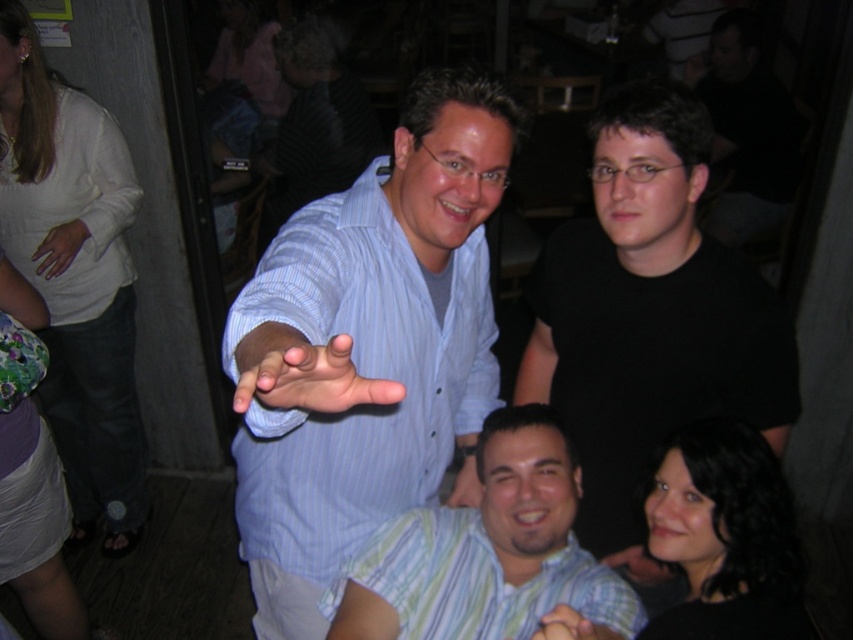
Between black matte shirt at upper right and matte blue shirt at center, which one is positioned higher?

matte blue shirt at center is above.

Between point (691, 193) and point (238, 403), which one is positioned in front?

Positioned in front is point (238, 403).

Locate an element on the screen. black matte shirt at upper right is located at coordinates (648, 312).

In the scene shown: Does white cotton shirt at upper left appear under matte skin hand at center?

Actually, white cotton shirt at upper left is above matte skin hand at center.

Is point (68, 116) closer to viewer compared to point (461, 458)?

Yes, point (68, 116) is closer to viewer.

Is point (61, 188) behind point (466, 486)?

Yes, it is behind point (466, 486).

The width and height of the screenshot is (853, 640). Identify the location of white cotton shirt at upper left. (76, 280).

Looking at this image, between black matte shirt at upper right and white cotton shirt at upper left, which one appears on the left side from the viewer's perspective?

From the viewer's perspective, white cotton shirt at upper left appears more on the left side.

Is black matte shirt at upper right to the left of white cotton shirt at upper left from the viewer's perspective?

Incorrect, black matte shirt at upper right is not on the left side of white cotton shirt at upper left.

Which is in front, point (735, 304) or point (16, 104)?

Point (735, 304)

The width and height of the screenshot is (853, 640). I want to click on black matte shirt at upper right, so click(648, 312).